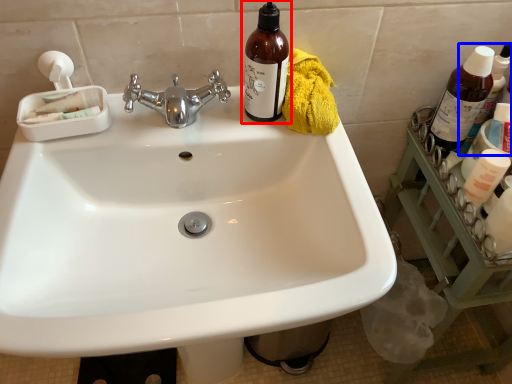
Question: Which of the following is the farthest to the observer, bottle (highlighted by a red box) or bottle (highlighted by a blue box)?

Choices:
 (A) bottle
 (B) bottle

Answer: (B)